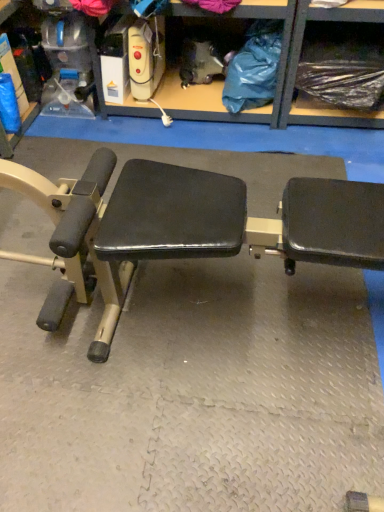
Question: Should I look upward or downward to see black plastic bag at upper right?

Choices:
 (A) down
 (B) up

Answer: (B)